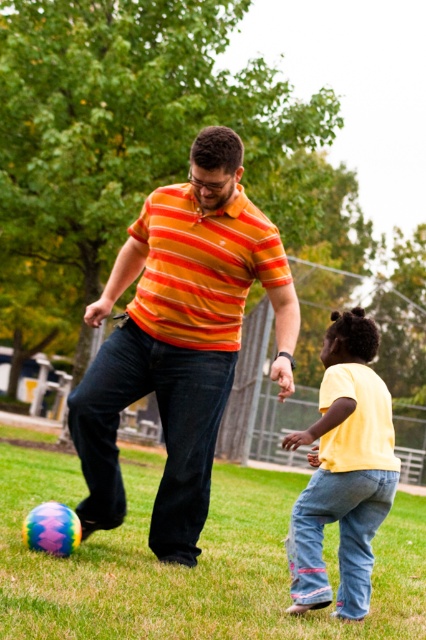
Question: Which of the following is the farthest from the observer?

Choices:
 (A) (325, 419)
 (B) (86, 456)

Answer: (B)

Question: Which point is closer to the camera taking this photo?

Choices:
 (A) (347, 570)
 (B) (123, 499)

Answer: (A)

Question: Does orange striped shirt at center appear on the right side of yellow matte shirt at lower right?

Choices:
 (A) no
 (B) yes

Answer: (A)

Question: Which object is closer to the camera taking this photo?

Choices:
 (A) orange striped shirt at center
 (B) yellow matte shirt at lower right

Answer: (B)

Question: Does orange striped shirt at center come behind yellow matte shirt at lower right?

Choices:
 (A) yes
 (B) no

Answer: (A)

Question: Can you confirm if orange striped shirt at center is positioned above yellow matte shirt at lower right?

Choices:
 (A) yes
 (B) no

Answer: (A)